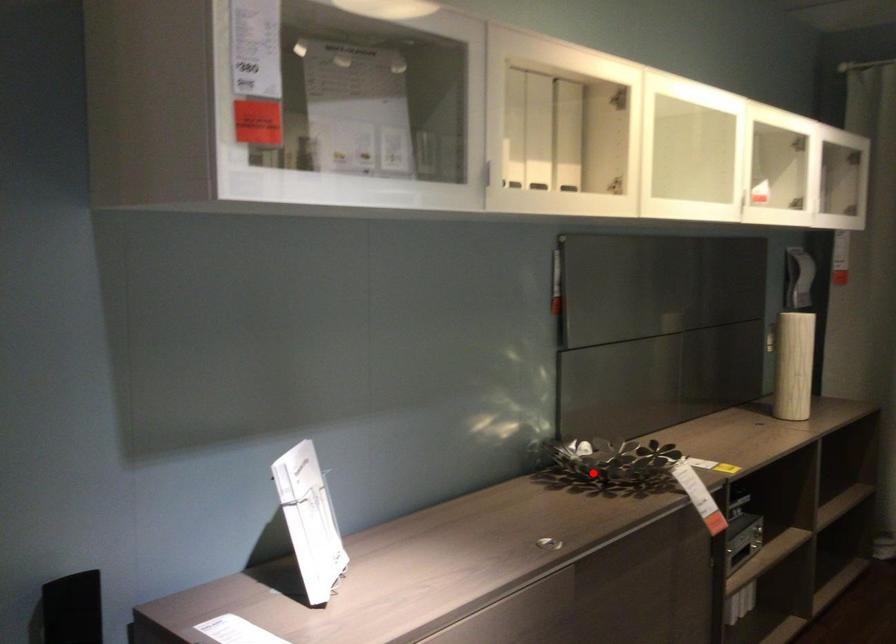
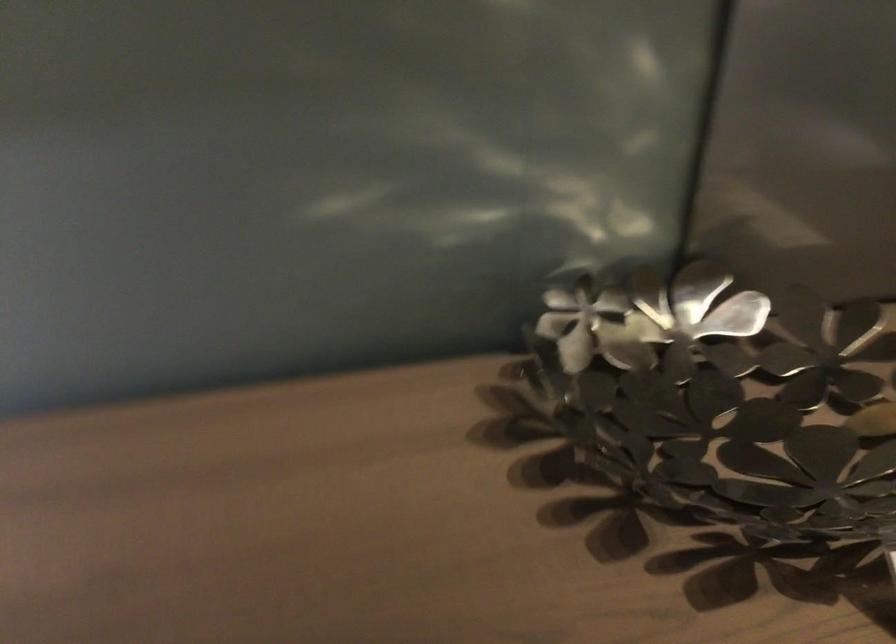
Question: A red point is marked in image1. In image2, is the corresponding 3D point closer to the camera or farther? Reply with the corresponding letter.

Choices:
 (A) The corresponding 3D point is closer.
 (B) The corresponding 3D point is farther.

Answer: (A)